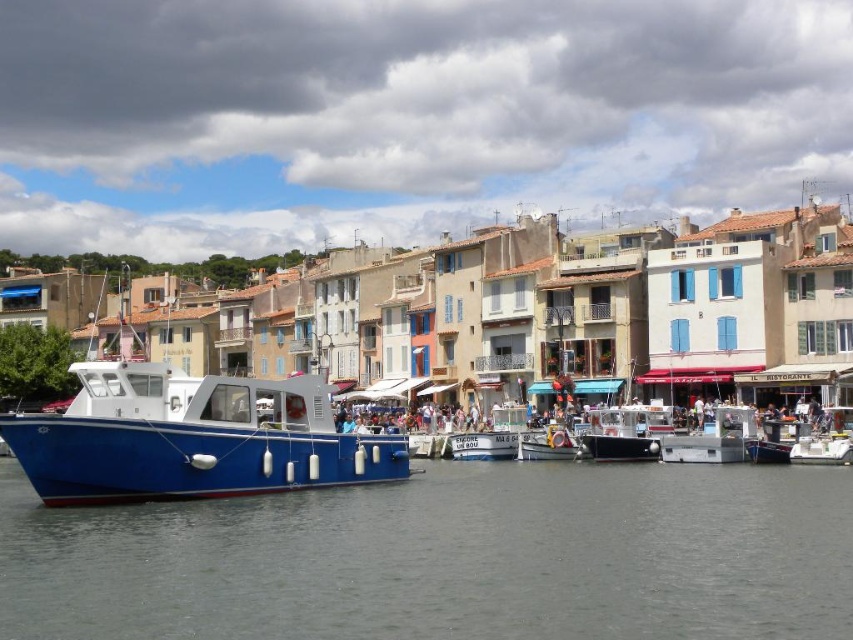
Question: Can you confirm if blue matte boat at left is wider than metallic silver boat at center?

Choices:
 (A) no
 (B) yes

Answer: (B)

Question: Which object appears farthest from the camera in this image?

Choices:
 (A) blue matte boat at left
 (B) black matte boat at center
 (C) gray water at lower center
 (D) metallic silver boat at center

Answer: (D)

Question: Which point is farther to the camera?

Choices:
 (A) (103, 476)
 (B) (630, 410)
 (C) (61, 611)
 (D) (579, 452)

Answer: (B)

Question: Among these points, which one is farthest from the camera?

Choices:
 (A) (570, 442)
 (B) (701, 531)
 (C) (183, 428)
 (D) (601, 428)

Answer: (A)

Question: Is the position of blue matte boat at left less distant than that of metallic silver boat at center?

Choices:
 (A) no
 (B) yes

Answer: (B)

Question: In this image, where is gray water at lower center located relative to blue matte boat at left?

Choices:
 (A) above
 (B) below

Answer: (B)